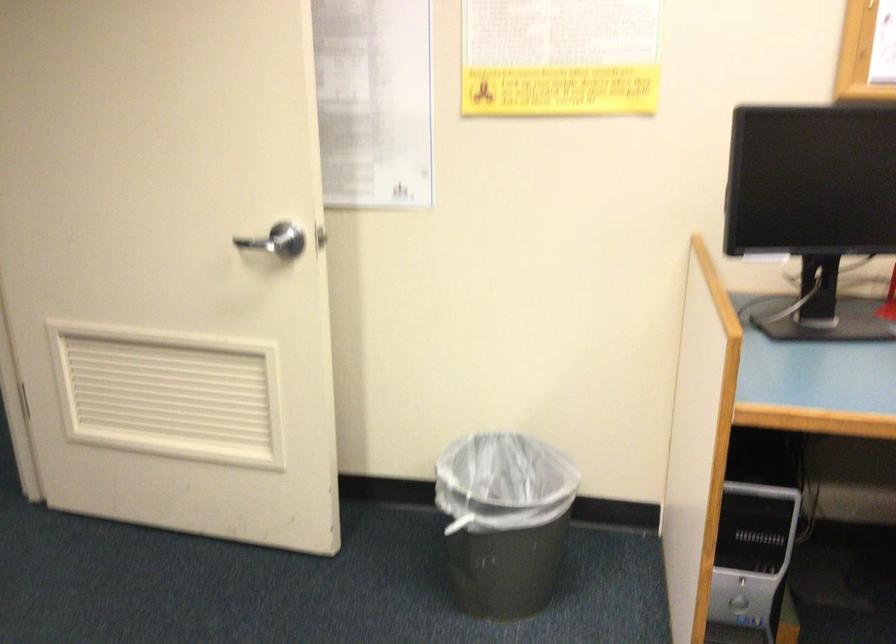
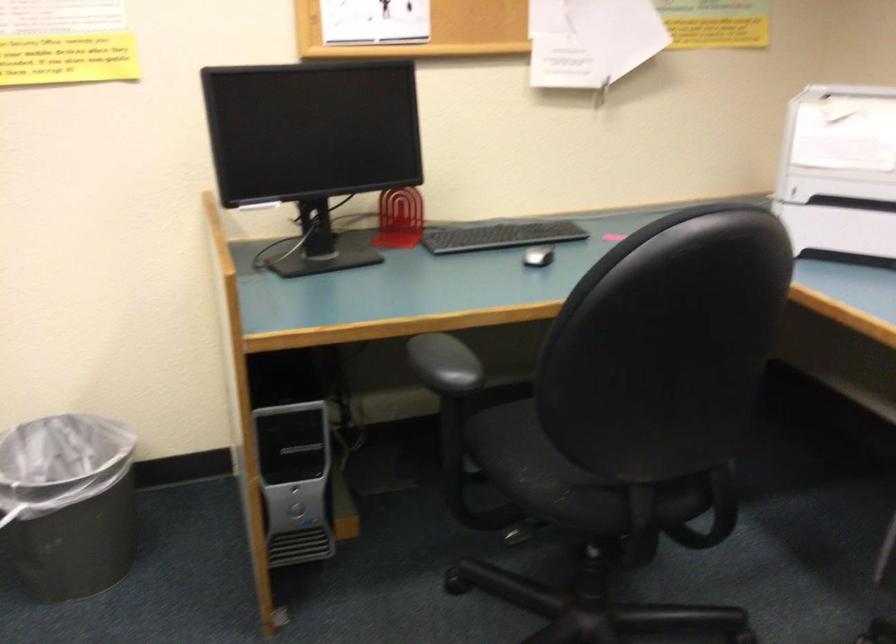
Find the pixel in the second image that matches the point at 504,522 in the first image.

(67, 504)